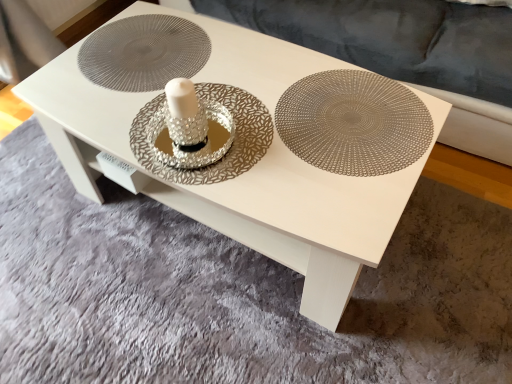
Find the location of a particular element. vacant space to the right of metallic silver doily at center is located at coordinates click(252, 57).